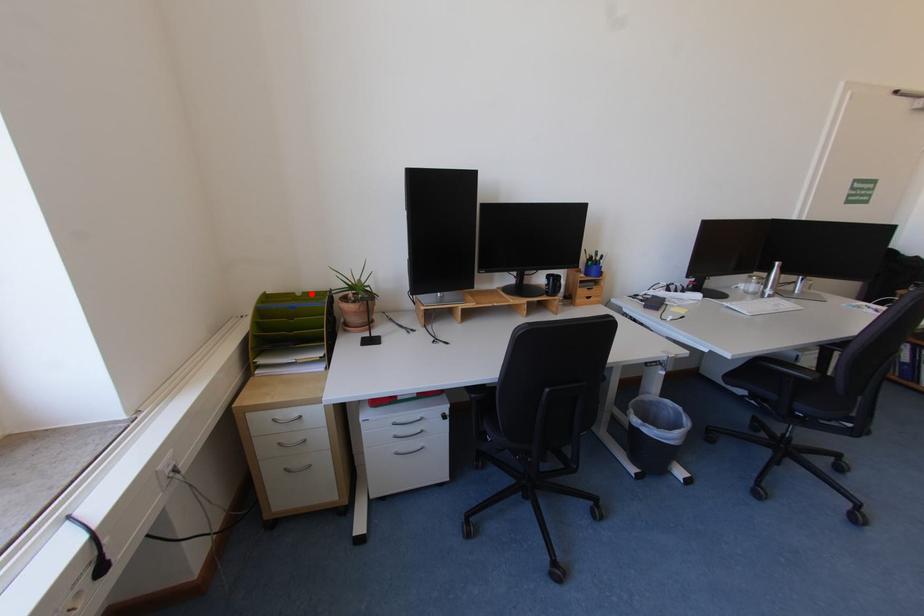
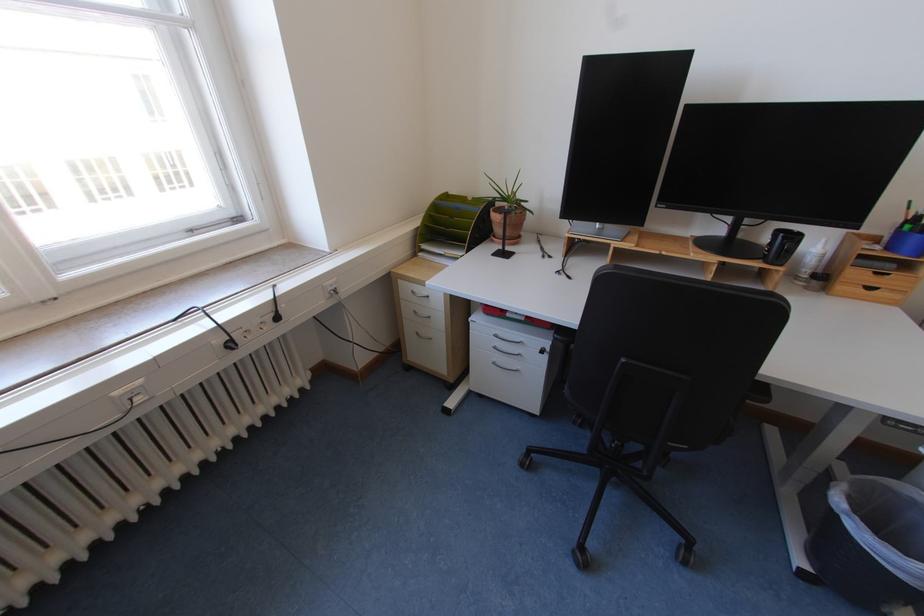
In the second image, find the point that corresponds to the highlighted location in the first image.

(481, 199)